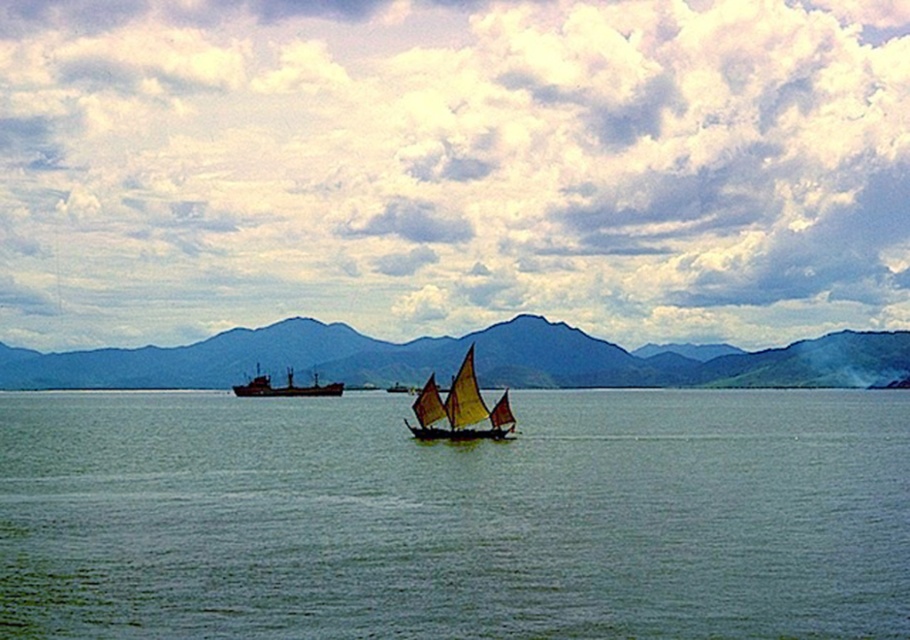
You are a sailor planning to dock your boat at the center of the image. Based on the scene, can you determine if the green smooth water at center is wide enough to accommodate the yellow fabric sailboat at center?

The green smooth water at center might be wider than yellow fabric sailboat at center, so it is possible that the water is wide enough to accommodate the boat. However, the exact width isn

You are a photographer planning to capture the yellow fabric sailboat at center and the dark gray matte cargo ship at center in a single frame. Given their sizes, which one will appear larger in the photo?

The dark gray matte cargo ship at center will appear larger in the photo because it is bigger than the yellow fabric sailboat at center.

You are standing on a cliff overlooking the seascape. You see the green smooth water at center and the dark blue mountain at center. How far apart are these two landmarks from each other?

The green smooth water at center is 267.09 meters away from the dark blue mountain at center.